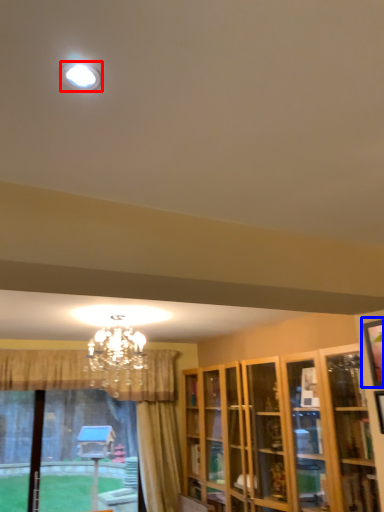
Question: Which object appears farthest to the camera in this image, lighting (highlighted by a red box) or picture frame (highlighted by a blue box)?

Choices:
 (A) lighting
 (B) picture frame

Answer: (B)